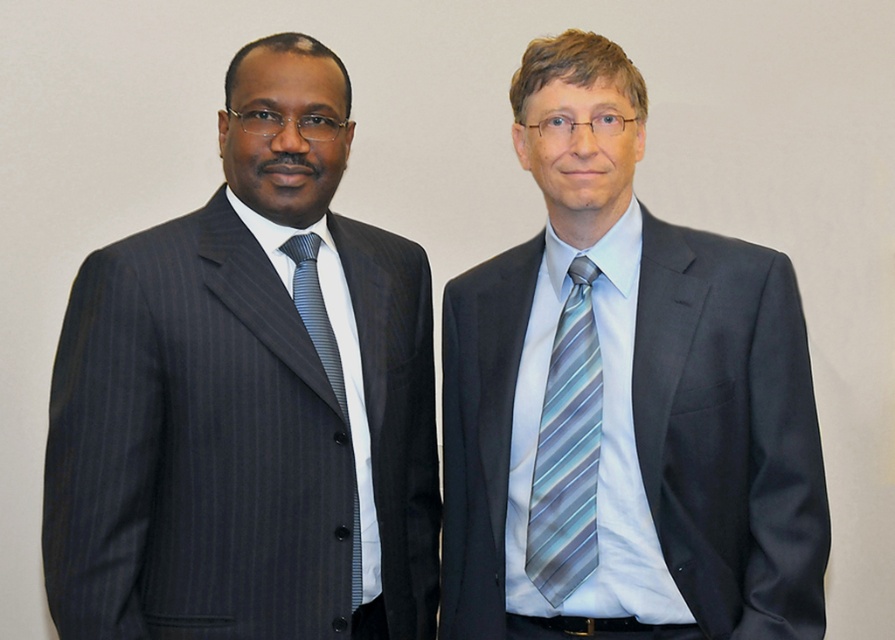
Based on the photo, you are a photographer setting up for a professional photo shoot. You need to ensure that the pinstriped suit at left and the blue striped tie at center are both visible in the frame. Given their height difference, which object will require you to adjust your camera angle upwards to capture properly?

The pinstriped suit at left has a greater height compared to the blue striped tie at center, so you will need to adjust your camera angle upwards to capture the pinstriped suit at left properly.

Based on the photo, you are a tailor measuring the two items displayed in the image. The matte gray suit at center and the blue striped tie at center are laid out on a table. You need to determine if both items can fit side by side on a 1.2 meter wide table. Can they fit if the total width of both items is less than 1.2 meters?

The matte gray suit at center is wider than the blue striped tie at center. Since the total width of both items must be less than 1.2 meters to fit side by side on the table, it depends on their combined width. If their combined width is under 1.2 meters, they can fit.

You are a tailor observing two formal attire items in the image. The pinstriped suit at left and the striped silk tie at left. Which item has a greater height?

The pinstriped suit at left has a greater height compared to the striped silk tie at left.